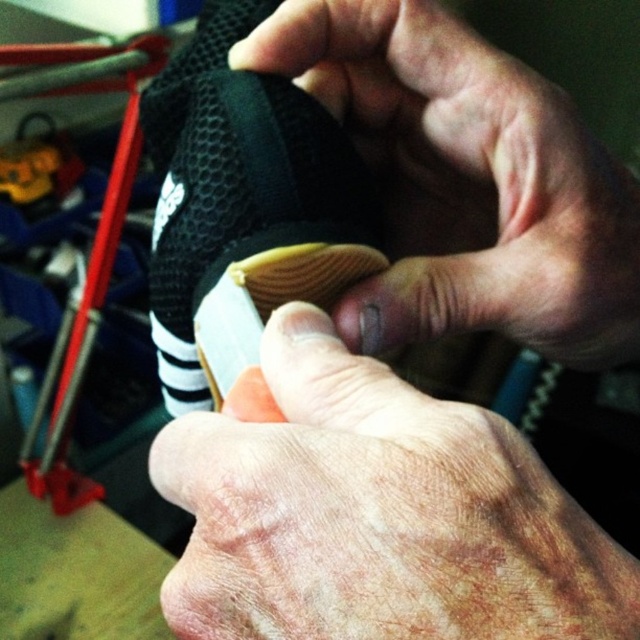
You are a shoemaker examining the dry skin at center and the black matte shoe at center. Which object would you need to handle with more care to avoid damaging it?

The black matte shoe at center requires more care since it is smaller than the dry skin at center and might be more delicate.

Please provide the 2D coordinates of the dry skin at center in the image. The coordinates should be in the format of a tuple with two decimal numbers separated by a comma. The first number represents the x coordinate, and the second number represents the y coordinate. The coordinate system is normalized, meaning the image spans from 0 to 1 in both axes. For example, a point at the center would be at coordinates like 0.5, 0.5. Please ensure that your answer strictly follows this format without any additional

The 2D coordinates of the dry skin at center are at point [376,513].

You are a shoemaker trying to fit a protective cover over both the dry skin at center and the black matte shoe at center. Which object requires a wider cover based on their widths?

The dry skin at center requires a wider cover because its width surpasses that of the black matte shoe at center.